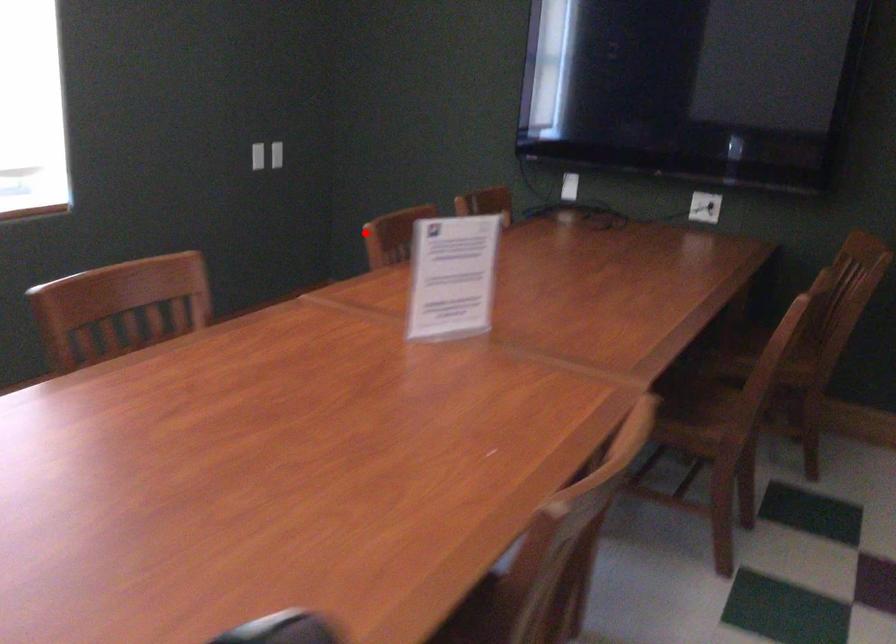
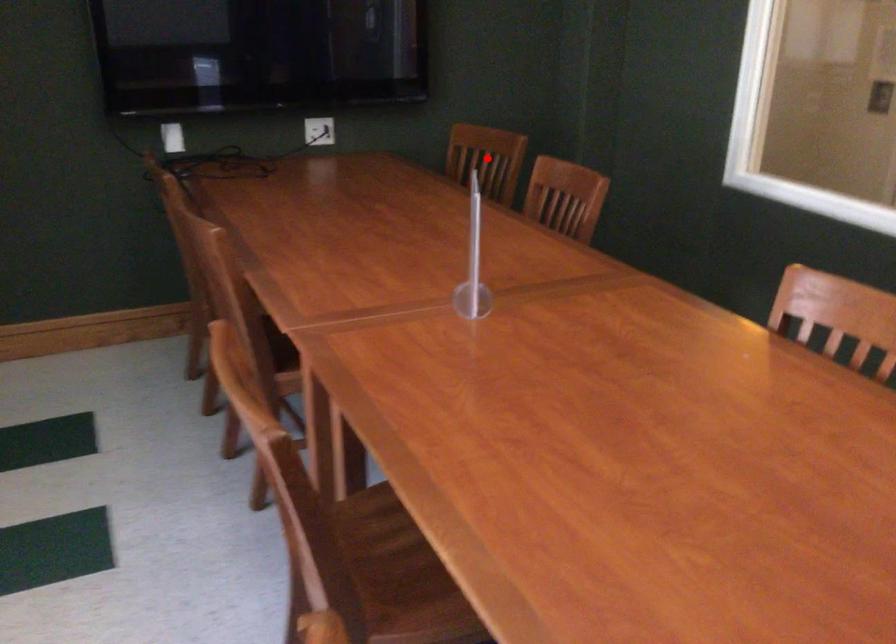
I am providing you with two images of the same scene from different viewpoints. A red point is marked on the first image and another point is marked on the second image. Are the points marked in image1 and image2 representing the same 3D position?

No